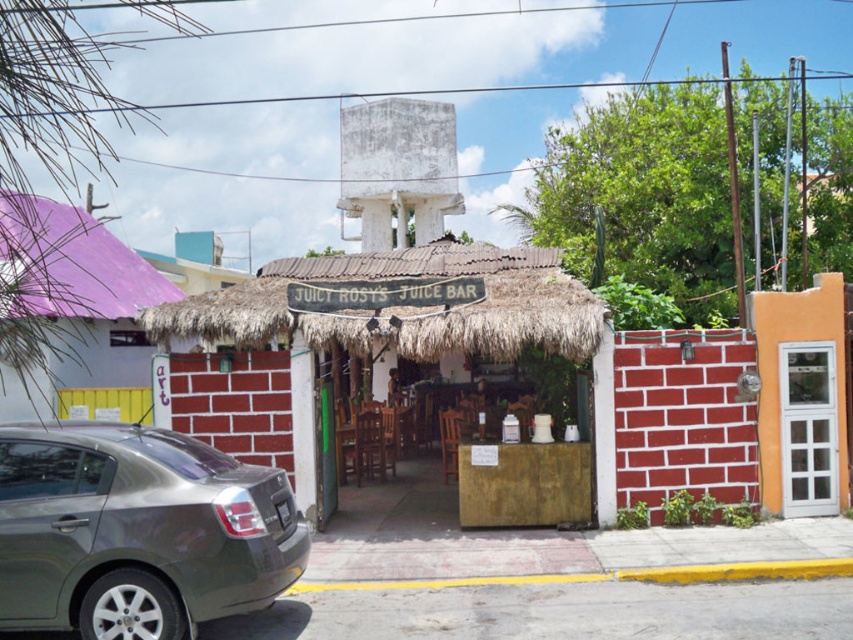
You are a delivery person needing to park your 4.5 meter long truck next to the metallic gray sedan at lower left and the thatched straw hut at center. Is there enough space between them to park your truck?

The metallic gray sedan at lower left is 4.21 meters away from the thatched straw hut at center. Since your truck is 4.5 meters long, the distance between them is insufficient to park your truck as it is shorter than the required space.